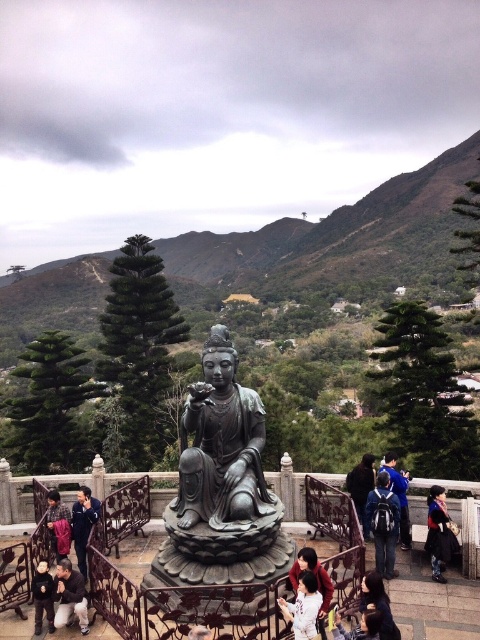
Who is more distant from viewer, (x=165, y=570) or (x=446, y=545)?

Positioned behind is point (x=446, y=545).

Is bronze statue at center wider than dark blue fabric at lower right?

Indeed, bronze statue at center has a greater width compared to dark blue fabric at lower right.

Which is in front, point (239, 410) or point (428, 540)?

Point (239, 410) is more forward.

Find the location of a particular element. This screenshot has height=640, width=480. bronze statue at center is located at coordinates (220, 484).

How far apart are dark blue backpack at center and camouflage jacket at lower left?

dark blue backpack at center is 6.36 meters away from camouflage jacket at lower left.

This screenshot has height=640, width=480. What are the coordinates of `dark blue backpack at center` in the screenshot? It's located at (384, 524).

What do you see at coordinates (220, 484) in the screenshot? I see `bronze statue at center` at bounding box center [220, 484].

Does bronze statue at center have a larger size compared to matte pink shirt at lower center?

Correct, bronze statue at center is larger in size than matte pink shirt at lower center.

Locate an element on the screen. The height and width of the screenshot is (640, 480). bronze statue at center is located at coordinates (220, 484).